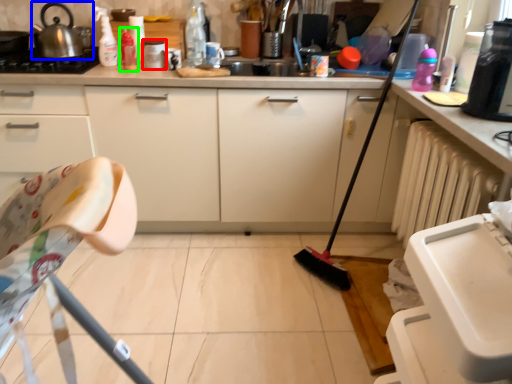
Question: Which is farther away from appliance (highlighted by a red box)? tea pot (highlighted by a blue box) or bottle (highlighted by a green box)?

Choices:
 (A) tea pot
 (B) bottle

Answer: (A)